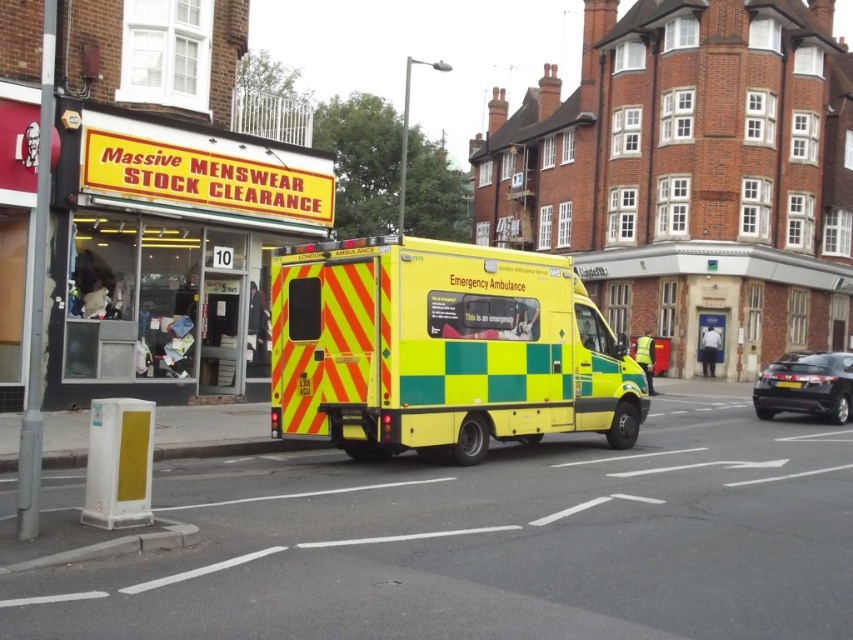
Question: Is yellow/green checkered emergency ambulance at center bigger than black metallic hatchback at right?

Choices:
 (A) no
 (B) yes

Answer: (A)

Question: Which point is farther to the camera?

Choices:
 (A) [637, 420]
 (B) [757, 392]

Answer: (B)

Question: Which of the following is the farthest from the observer?

Choices:
 (A) black metallic hatchback at right
 (B) yellow/green checkered emergency ambulance at center

Answer: (A)

Question: Does yellow/green checkered emergency ambulance at center appear on the left side of black metallic hatchback at right?

Choices:
 (A) yes
 (B) no

Answer: (A)

Question: Considering the relative positions of yellow/green checkered emergency ambulance at center and black metallic hatchback at right in the image provided, where is yellow/green checkered emergency ambulance at center located with respect to black metallic hatchback at right?

Choices:
 (A) above
 (B) below

Answer: (A)